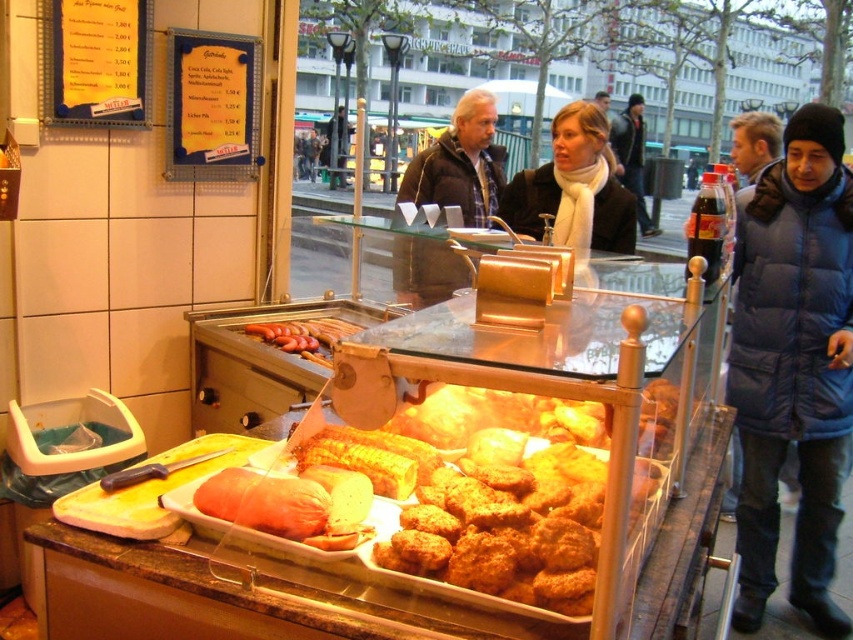
Between white scarf at center and dark blue puffer jacket at center, which one has more height?

With more height is dark blue puffer jacket at center.

Image resolution: width=853 pixels, height=640 pixels. I want to click on white scarf at center, so click(x=573, y=188).

Locate an element on the screen. white scarf at center is located at coordinates (573, 188).

Can you confirm if smooth pinkish-brown sausage at center is taller than dark blue puffer jacket at right?

Incorrect, smooth pinkish-brown sausage at center's height is not larger of dark blue puffer jacket at right's.

Between smooth pinkish-brown sausage at center and dark blue puffer jacket at right, which one has less height?

Standing shorter between the two is smooth pinkish-brown sausage at center.

The image size is (853, 640). I want to click on smooth pinkish-brown sausage at center, so pyautogui.click(x=287, y=506).

Does white scarf at center appear over smooth pinkish-brown sausage at center?

Correct, white scarf at center is located above smooth pinkish-brown sausage at center.

Is white scarf at center wider than smooth pinkish-brown sausage at center?

Yes, white scarf at center is wider than smooth pinkish-brown sausage at center.

Locate an element on the screen. white scarf at center is located at coordinates (573, 188).

This screenshot has width=853, height=640. Identify the location of white scarf at center. (573, 188).